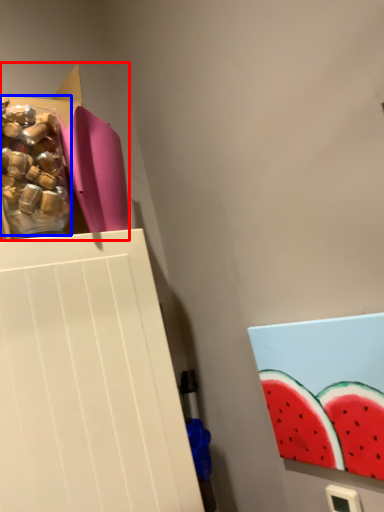
Question: Which point is further to the camera, storage box (highlighted by a red box) or food (highlighted by a blue box)?

Choices:
 (A) storage box
 (B) food

Answer: (A)